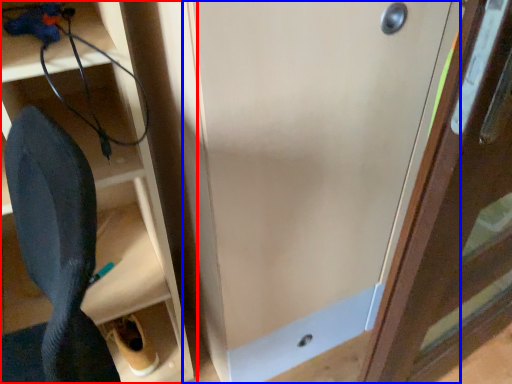
Question: Which object is further to the camera taking this photo, shelf (highlighted by a red box) or door (highlighted by a blue box)?

Choices:
 (A) shelf
 (B) door

Answer: (B)